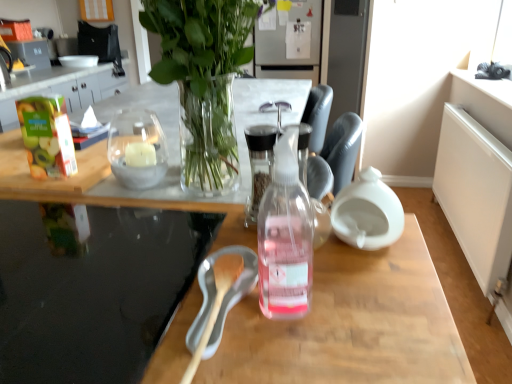
This screenshot has width=512, height=384. Identify the location of transparent glass table at lower left. (93, 292).

What do you see at coordinates (204, 81) in the screenshot?
I see `clear glass vase at upper center` at bounding box center [204, 81].

This screenshot has height=384, width=512. Describe the element at coordinates (285, 236) in the screenshot. I see `clear glass bottle at center` at that location.

Describe the element at coordinates (137, 149) in the screenshot. I see `clear glass candle at center` at that location.

Image resolution: width=512 pixels, height=384 pixels. Describe the element at coordinates (47, 136) in the screenshot. I see `green matte apple juice at left` at that location.

You are a GUI agent. You are given a task and a screenshot of the screen. Output one action in this format:
    pyautogui.click(x=<x>, y=<y>)
    Task: Click on the transparent glass table at lower left
    This screenshot has height=384, width=512.
    Given the screenshot: What is the action you would take?
    pyautogui.click(x=93, y=292)

Image resolution: width=512 pixels, height=384 pixels. In order to click on houseplant on the right of clear glass candle at center in this screenshot , I will do pos(204,81).

Which of these two, clear glass vase at upper center or clear glass candle at center, is smaller?

Smaller between the two is clear glass candle at center.

Can you confirm if clear glass vase at upper center is wider than clear glass candle at center?

Indeed, clear glass vase at upper center has a greater width compared to clear glass candle at center.

In the scene shown: Is clear glass vase at upper center completely or partially outside of clear glass candle at center?

Indeed, clear glass vase at upper center is completely outside clear glass candle at center.

Would you say green matte apple juice at left is inside or outside clear glass bottle at center?

green matte apple juice at left is not enclosed by clear glass bottle at center.

Locate an element on the screen. The width and height of the screenshot is (512, 384). food behind the clear glass bottle at center is located at coordinates (47, 136).

Which is less distant, [26,100] or [305,306]?

The point [305,306] is more forward.

From the image's perspective, is green matte apple juice at left below clear glass bottle at center?

Actually, green matte apple juice at left appears above clear glass bottle at center in the image.

Can you confirm if transparent plastic bottle at center is positioned to the right of green matte apple juice at left?

Correct, you'll find transparent plastic bottle at center to the right of green matte apple juice at left.

Is transparent plastic bottle at center facing away from green matte apple juice at left?

transparent plastic bottle at center is not turned away from green matte apple juice at left.

Is transparent plastic bottle at center outside of green matte apple juice at left?

Yes.

What's the angular difference between transparent plastic bottle at center and green matte apple juice at left's facing directions?

transparent plastic bottle at center and green matte apple juice at left are facing 93.1 degrees away from each other.

Looking at this image, considering the sizes of objects clear glass candle at center and clear glass vase at upper center in the image provided, who is taller, clear glass candle at center or clear glass vase at upper center?

Standing taller between the two is clear glass vase at upper center.

From the image's perspective, between clear glass candle at center and clear glass vase at upper center, who is located below?

clear glass candle at center is shown below in the image.

Is clear glass candle at center turned away from clear glass vase at upper center?

Yes.

This screenshot has height=384, width=512. There is a clear glass candle at center. Identify the location of houseplant above it (from a real-world perspective). (204, 81).

Could transparent plastic bottle at center be considered to be inside green matte apple juice at left?

No, transparent plastic bottle at center is not surrounded by green matte apple juice at left.

Locate an element on the screen. desk below the green matte apple juice at left (from a real-world perspective) is located at coordinates (350, 325).

Is point (33, 108) closer or farther from the camera than point (163, 231)?

Point (33, 108).

Which of these two, green matte apple juice at left or transparent plastic bottle at center, is smaller?

green matte apple juice at left.

Find the location of a particular element. This screenshot has height=384, width=512. bottle that is on the right side of transparent glass table at lower left is located at coordinates (285, 236).

Is point (273, 189) positioned behind point (9, 301)?

That is False.

Is clear glass bottle at center to the right of transparent glass table at lower left from the viewer's perspective?

Correct, you'll find clear glass bottle at center to the right of transparent glass table at lower left.

Where is `houseplant above the clear glass bottle at center (from a real-world perspective)`? Image resolution: width=512 pixels, height=384 pixels. houseplant above the clear glass bottle at center (from a real-world perspective) is located at coordinates point(204,81).

Would you say clear glass bottle at center is a long distance from clear glass vase at upper center?

No, there isn't a large distance between clear glass bottle at center and clear glass vase at upper center.

Which is closer to the camera, (297,130) or (193,7)?

Point (297,130)

Where is `houseplant on the right of clear glass candle at center`? The width and height of the screenshot is (512, 384). houseplant on the right of clear glass candle at center is located at coordinates (204, 81).

You are a GUI agent. You are given a task and a screenshot of the screen. Output one action in this format:
    pyautogui.click(x=<x>, y=<y>)
    Task: Click on the bottle in front of the green matte apple juice at left
    
    Given the screenshot: What is the action you would take?
    pyautogui.click(x=285, y=236)

Looking at the image, which one is located further to clear glass bottle at center, transparent plastic bottle at center or green matte apple juice at left?

The object further to clear glass bottle at center is green matte apple juice at left.

From the image, which object appears to be farther from green matte apple juice at left, transparent plastic bottle at center or clear glass bottle at center?

clear glass bottle at center.

From the image, which object appears to be farther from transparent plastic bottle at center, transparent glass table at lower left or clear glass bottle at center?

clear glass bottle at center lies further to transparent plastic bottle at center than the other object.

From the image, which object appears to be nearer to transparent plastic bottle at center, green matte apple juice at left or clear glass candle at center?

The object closer to transparent plastic bottle at center is clear glass candle at center.

Considering their positions, is clear glass bottle at center positioned closer to transparent plastic bottle at center than clear glass candle at center?

Based on the image, clear glass bottle at center appears to be nearer to transparent plastic bottle at center.

From the image, which object appears to be nearer to transparent plastic bottle at center, clear glass candle at center or clear glass bottle at center?

clear glass bottle at center lies closer to transparent plastic bottle at center than the other object.

From the image, which object appears to be farther from transparent glass table at lower left, clear glass vase at upper center or clear glass bottle at center?

The object further to transparent glass table at lower left is clear glass vase at upper center.

Considering their positions, is clear glass bottle at center positioned further to clear glass vase at upper center than transparent plastic bottle at center?

transparent plastic bottle at center is positioned further to the anchor clear glass vase at upper center.

Image resolution: width=512 pixels, height=384 pixels. What are the coordinates of `houseplant between transparent glass table at lower left and green matte apple juice at left from front to back` in the screenshot? It's located at (204, 81).

You are a GUI agent. You are given a task and a screenshot of the screen. Output one action in this format:
    pyautogui.click(x=<x>, y=<y>)
    Task: Click on the glass table between green matte apple juice at left and clear glass bottle at center from left to right
    
    Given the screenshot: What is the action you would take?
    pyautogui.click(x=93, y=292)

Image resolution: width=512 pixels, height=384 pixels. Find the location of `tableware between green matte apple juice at left and clear glass vase at upper center in the horizontal direction`. tableware between green matte apple juice at left and clear glass vase at upper center in the horizontal direction is located at coordinates [x=137, y=149].

The image size is (512, 384). Find the location of `glass table that lies between clear glass vase at upper center and transparent plastic bottle at center from top to bottom`. glass table that lies between clear glass vase at upper center and transparent plastic bottle at center from top to bottom is located at coordinates (93, 292).